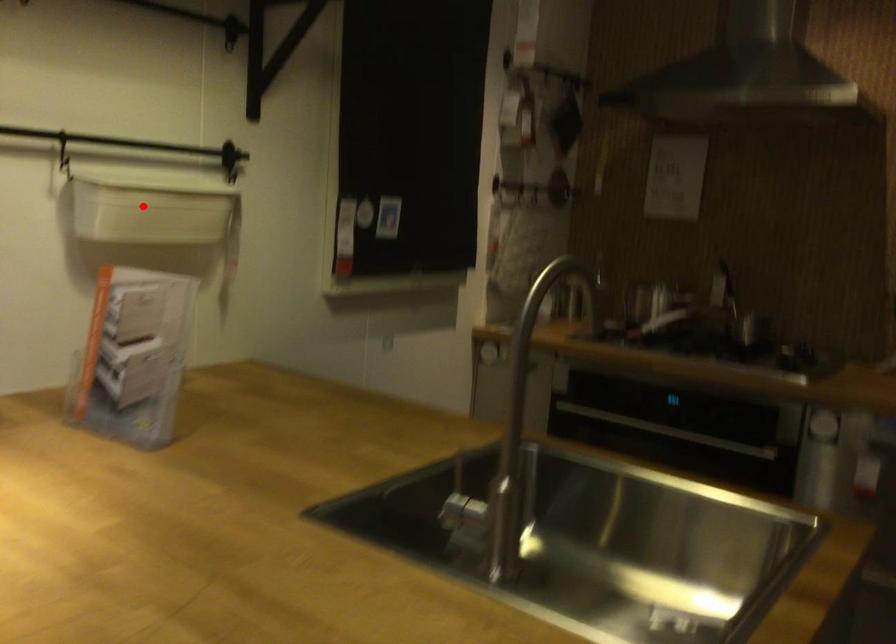
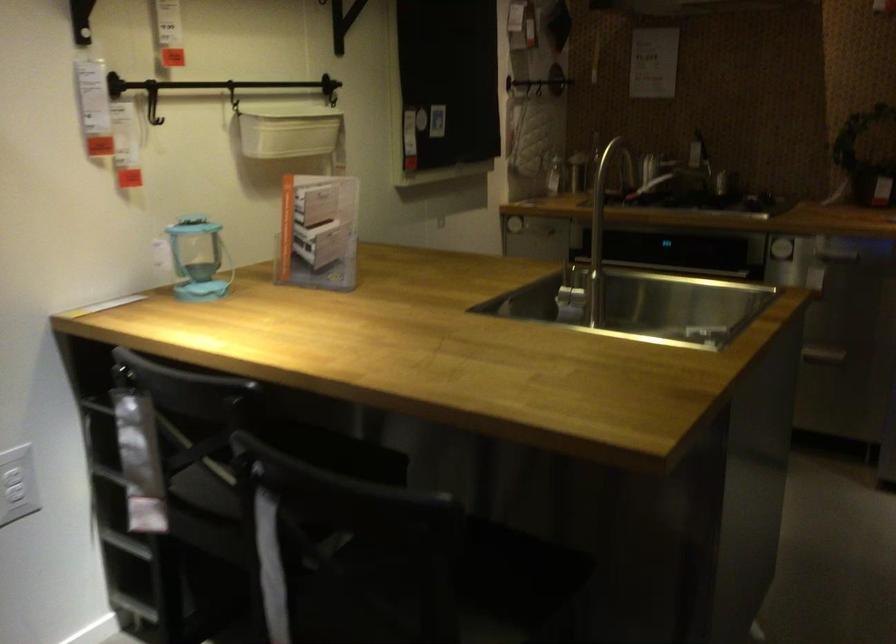
Question: I am providing you with two images of the same scene from different viewpoints. A red point is marked on the first image. Is the red point's position out of view in image 2?

Choices:
 (A) Yes
 (B) No

Answer: (B)